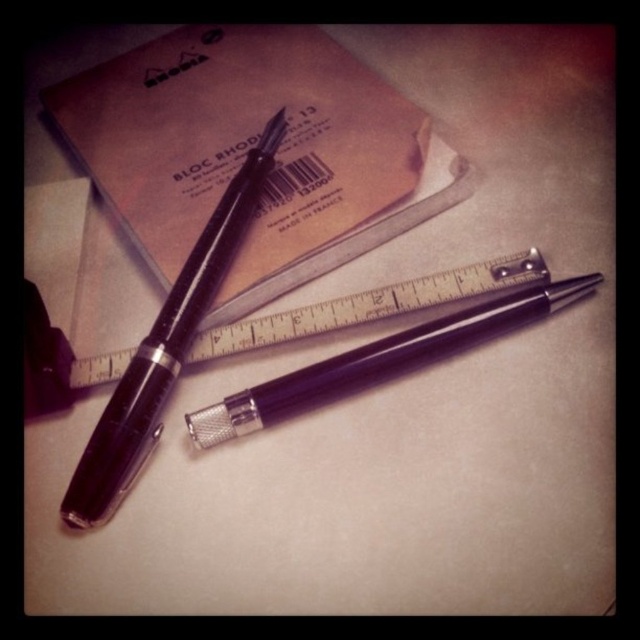
Between matte black pen at upper left and metallic silver ruler at center, which one has less height?

metallic silver ruler at center

Can you confirm if matte black pen at upper left is positioned above metallic silver ruler at center?

Yes, matte black pen at upper left is above metallic silver ruler at center.

At what (x,y) coordinates should I click in order to perform the action: click on matte black pen at upper left. Please return your answer as a coordinate pair (x, y). Looking at the image, I should click on (164, 348).

Does matte black fountain pen at center appear under metallic silver ruler at center?

Yes.

Which is in front, point (269, 410) or point (451, 289)?

Positioned in front is point (269, 410).

What are the coordinates of `matte black fountain pen at center` in the screenshot? It's located at (372, 362).

Identify the location of matte black pen at upper left. (164, 348).

Identify the location of matte black pen at upper left. (164, 348).

Locate an element on the screen. matte black pen at upper left is located at coordinates (164, 348).